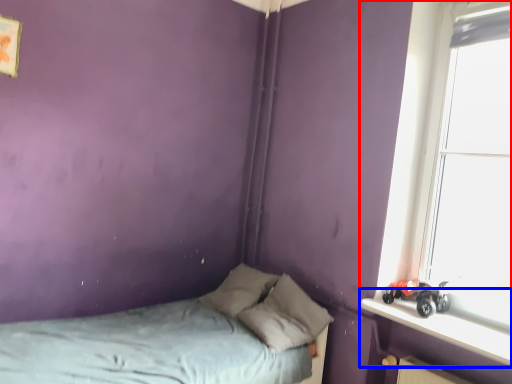
Question: Which of the following is the closest to the observer, window (highlighted by a red box) or window sill (highlighted by a blue box)?

Choices:
 (A) window
 (B) window sill

Answer: (B)